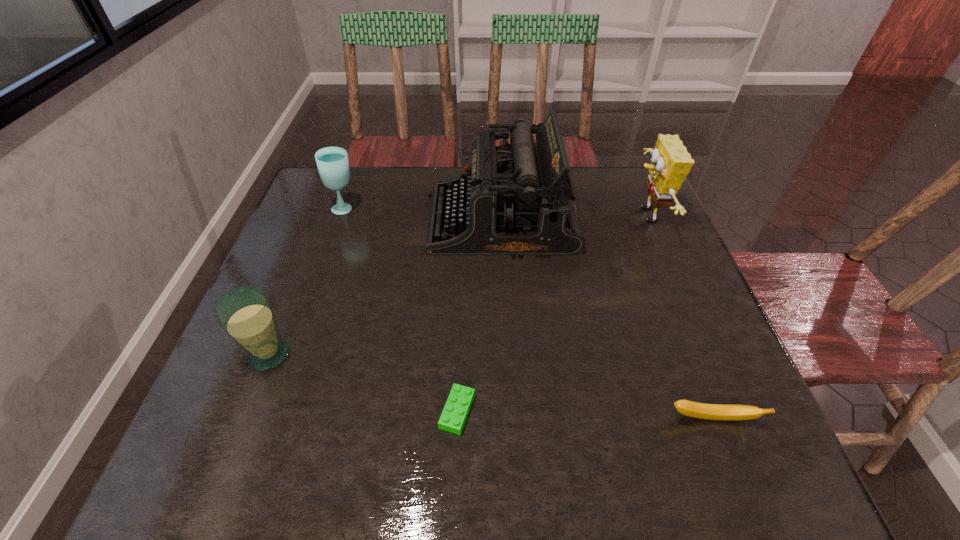
At what (x,y) coordinates should I click in order to perform the action: click on typewriter. Please return your answer as a coordinate pair (x, y). Looking at the image, I should click on (515, 199).

Where is `the second tallest object`? This screenshot has height=540, width=960. the second tallest object is located at coordinates (670, 163).

The image size is (960, 540). I want to click on the farther glass, so click(332, 162).

Locate an element on the screen. The width and height of the screenshot is (960, 540). the nearer glass is located at coordinates (245, 313).

Find the location of a particular element. The width and height of the screenshot is (960, 540). the second shortest object is located at coordinates (692, 409).

Locate an element on the screen. the shortest object is located at coordinates (455, 412).

You are a GUI agent. You are given a task and a screenshot of the screen. Output one action in this format:
    pyautogui.click(x=<x>, y=<y>)
    Task: Click on the vacant space situated on the keyboard of the typewriter
    This screenshot has width=960, height=540.
    Given the screenshot: What is the action you would take?
    click(x=339, y=220)

You are a GUI agent. You are given a task and a screenshot of the screen. Output one action in this format:
    pyautogui.click(x=<x>, y=<y>)
    Task: Click on the vacant space located 0.210m on the keyboard of the typewriter
    
    Given the screenshot: What is the action you would take?
    pyautogui.click(x=349, y=220)

You are a GUI agent. You are given a task and a screenshot of the screen. Output one action in this format:
    pyautogui.click(x=<x>, y=<y>)
    Task: Click on the free location located 0.360m on the keyboard of the typewriter
    
    Given the screenshot: What is the action you would take?
    pyautogui.click(x=295, y=220)

At what (x,y) coordinates should I click in order to perform the action: click on free location located on the face of the second tallest object. Please return your answer as a coordinate pair (x, y). Image resolution: width=960 pixels, height=540 pixels. Looking at the image, I should click on (542, 216).